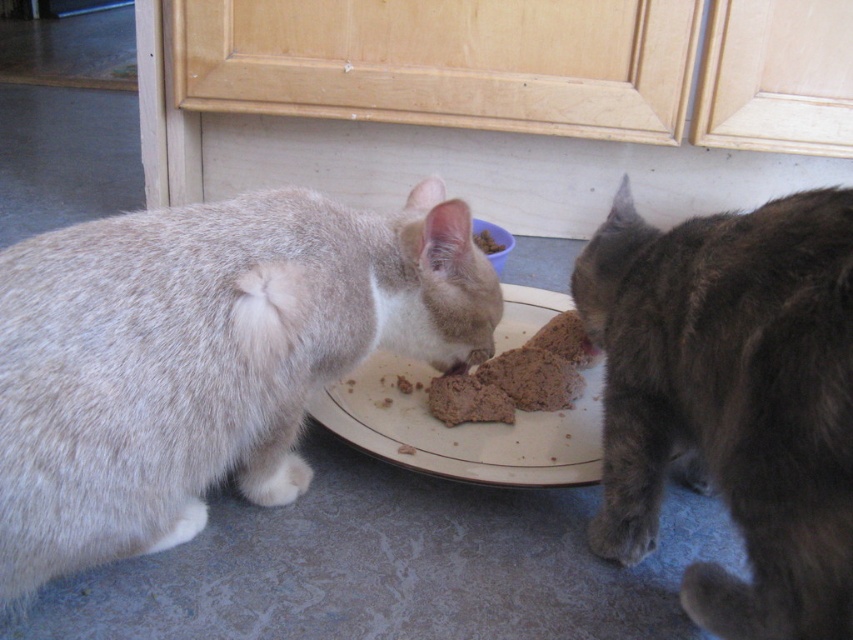
Question: Among these points, which one is farthest from the camera?

Choices:
 (A) (514, 448)
 (B) (846, 204)
 (C) (440, 412)

Answer: (C)

Question: Which point is farther to the camera?

Choices:
 (A) (323, 216)
 (B) (438, 417)
 (C) (770, 474)

Answer: (B)

Question: Is gray fur cat at right in front of brown crumbly food at center?

Choices:
 (A) no
 (B) yes

Answer: (B)

Question: Which point is closer to the camera?

Choices:
 (A) gray fur cat at right
 (B) brown crumbly food at center
 (C) gray fluffy cat at left

Answer: (A)

Question: Does white glossy plate at center appear over brown crumbly food at center?

Choices:
 (A) no
 (B) yes

Answer: (B)

Question: Can you confirm if gray fluffy cat at left is positioned to the left of gray fur cat at right?

Choices:
 (A) yes
 (B) no

Answer: (A)